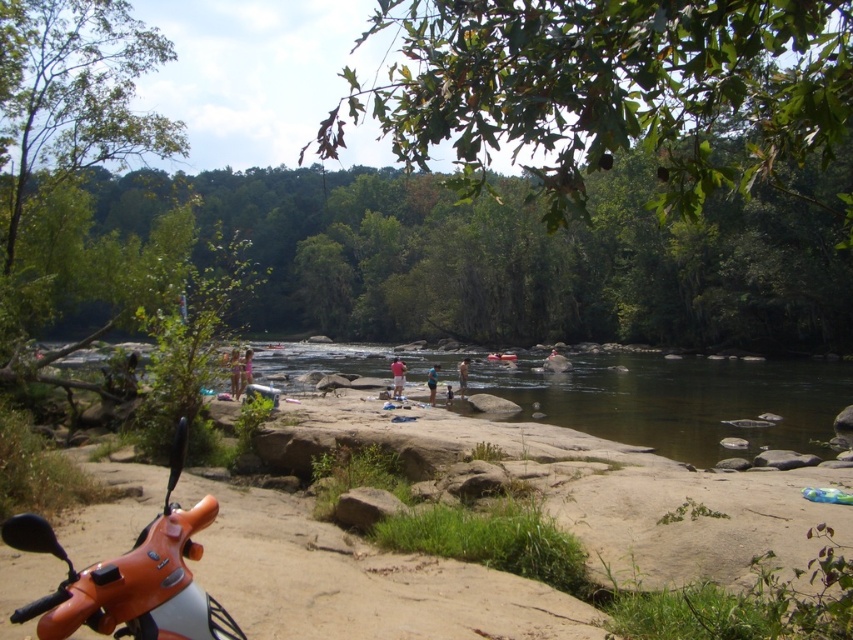
From the picture: You are standing at the riverside and want to walk towards the point that is closer to you. Which point should you head towards, point (88, 592) or point (393, 376)?

You should head towards point (88, 592) because it is closer to the viewer than point (393, 376).

You are a photographer trying to capture a person wearing a tan cotton shirt at center and tan fabric shorts at center. Since both items are tan, how can you tell them apart in the image?

The tan cotton shirt at center is positioned on the left side of tan fabric shorts at center, so the shirt is to the left of the shorts in the image.